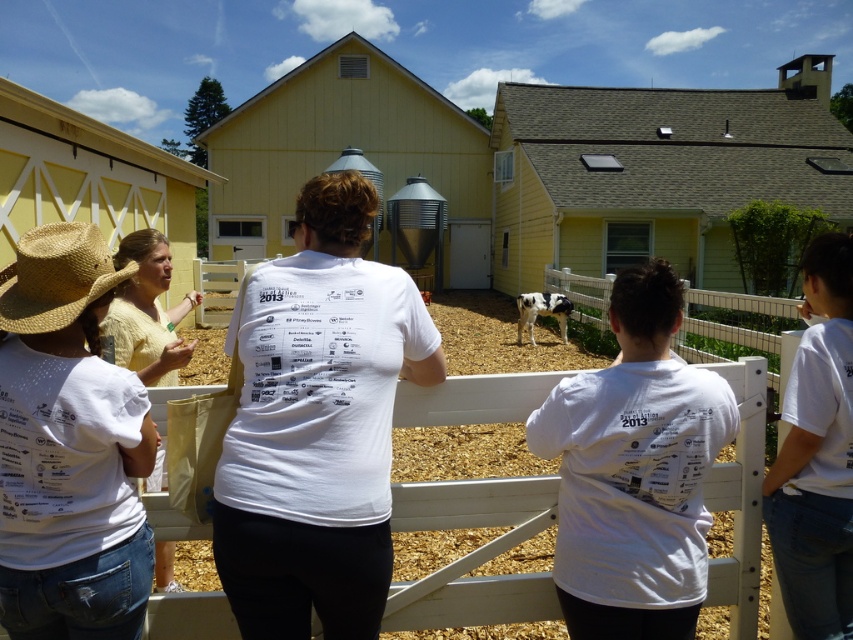
You are a photographer trying to capture a group photo of the people behind the fence. You notice the white matte shirt at center and the natural straw cowboy hat at left. Which of these two items has a greater horizontal width when viewed from your camera position?

The white matte shirt at center has a greater horizontal width than the natural straw cowboy hat at left.